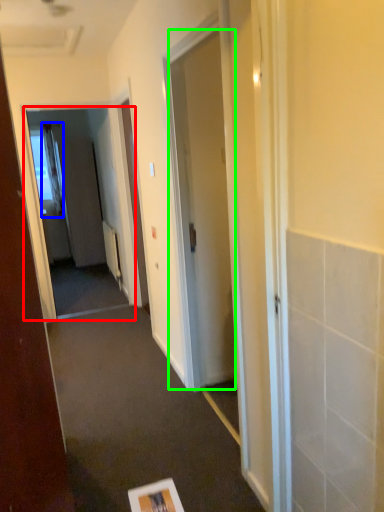
Question: Based on their relative distances, which object is farther from screen door (highlighted by a red box)? Choose from curtain (highlighted by a blue box) and door (highlighted by a green box).

Choices:
 (A) curtain
 (B) door

Answer: (B)